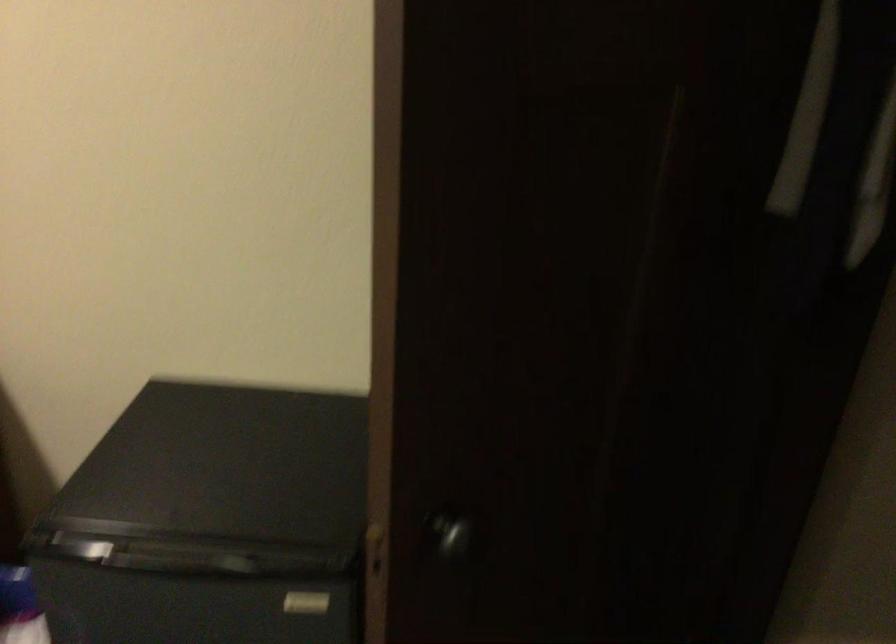
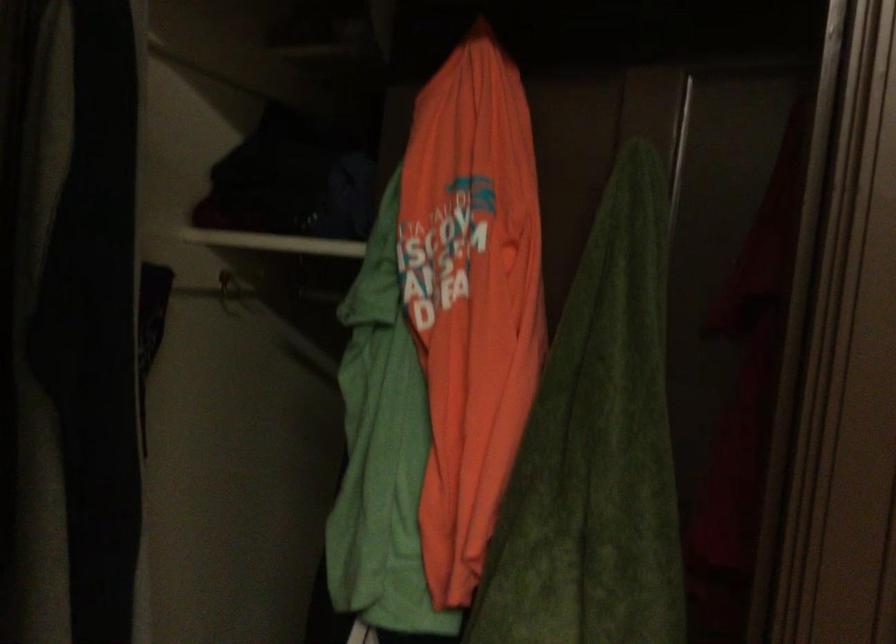
Question: The camera is either moving clockwise (left) or counter-clockwise (right) around the object. The first image is from the beginning of the video and the second image is from the end. Is the camera moving left or right when shooting the video?

Choices:
 (A) Left
 (B) Right

Answer: (A)